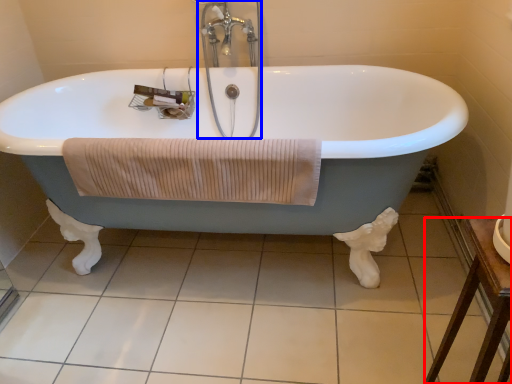
Question: Among these objects, which one is farthest to the camera, furniture (highlighted by a red box) or faucet (highlighted by a blue box)?

Choices:
 (A) furniture
 (B) faucet

Answer: (B)